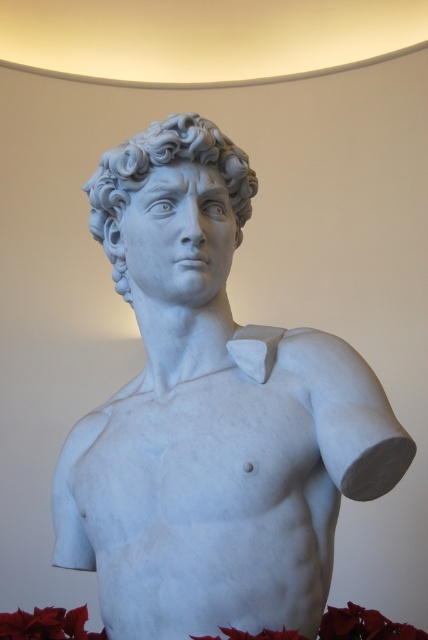
You are an art student observing the classical marble sculpture. You notice two parts of the sculpture labeled as the white marble bust at center and the white marble head at center. Which part is positioned lower in the image?

The white marble bust at center is located below the white marble head at center, so the white marble bust at center is positioned lower in the image.

You are an art student analyzing the classical marble sculpture. You notice two parts of the sculpture labeled as the white marble bust at center and the white marble head at center. Which part is positioned more towards the right side of the image?

The white marble bust at center is positioned more towards the right side of the image compared to the white marble head at center.

You are an art student standing in front of the white marble bust at center. You want to sketch the sculpture from a position where its eyes are at the same height as your eyes. Where should you stand relative to the sculpture?

The white marble bust at center is positioned at point 0.652 on the horizontal axis and 0.493 on the vertical axis. To align your eye level with the sculpture eyes, you should stand directly in front of it at the same horizontal position, ensuring your eyes are at the vertical height of 0.493.